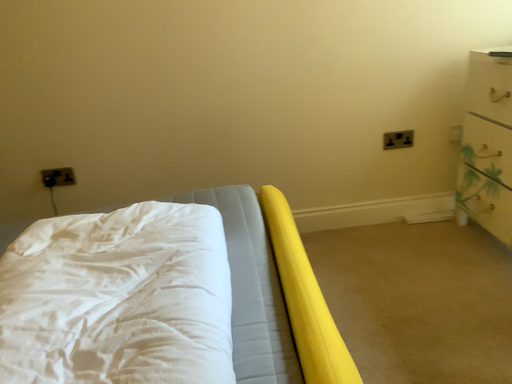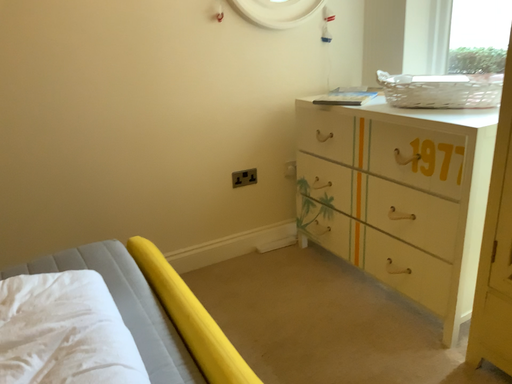
Question: How did the camera likely rotate when shooting the video?

Choices:
 (A) rotated upward
 (B) rotated downward

Answer: (A)